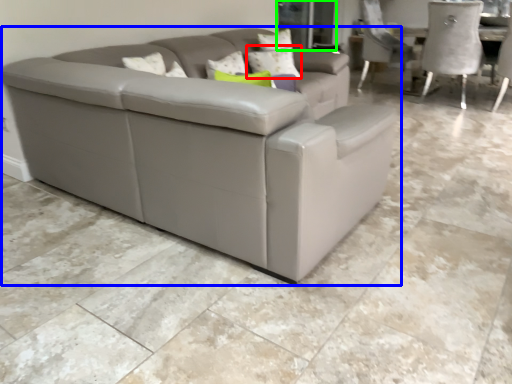
Question: Which object is positioned closest to pillow (highlighted by a red box)? Select from studio couch (highlighted by a blue box) and glass door (highlighted by a green box).

Choices:
 (A) studio couch
 (B) glass door

Answer: (A)